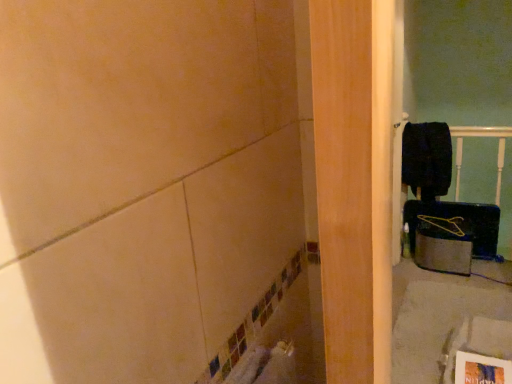
Question: In terms of size, does yellow plastic hanger at right appear bigger or smaller than black matte laundry at upper right?

Choices:
 (A) small
 (B) big

Answer: (A)

Question: Considering the positions of point (454, 216) and point (418, 157), is point (454, 216) closer or farther from the camera than point (418, 157)?

Choices:
 (A) farther
 (B) closer

Answer: (A)

Question: Considering the positions of yellow plastic hanger at right and black matte laundry at upper right in the image, is yellow plastic hanger at right wider or thinner than black matte laundry at upper right?

Choices:
 (A) thin
 (B) wide

Answer: (B)

Question: Considering the positions of black matte laundry at upper right and yellow plastic hanger at right in the image, is black matte laundry at upper right wider or thinner than yellow plastic hanger at right?

Choices:
 (A) thin
 (B) wide

Answer: (A)

Question: Is black matte laundry at upper right inside the boundaries of yellow plastic hanger at right, or outside?

Choices:
 (A) inside
 (B) outside

Answer: (B)

Question: Is black matte laundry at upper right in front of or behind yellow plastic hanger at right in the image?

Choices:
 (A) behind
 (B) front

Answer: (A)

Question: Is black matte laundry at upper right bigger or smaller than yellow plastic hanger at right?

Choices:
 (A) small
 (B) big

Answer: (B)